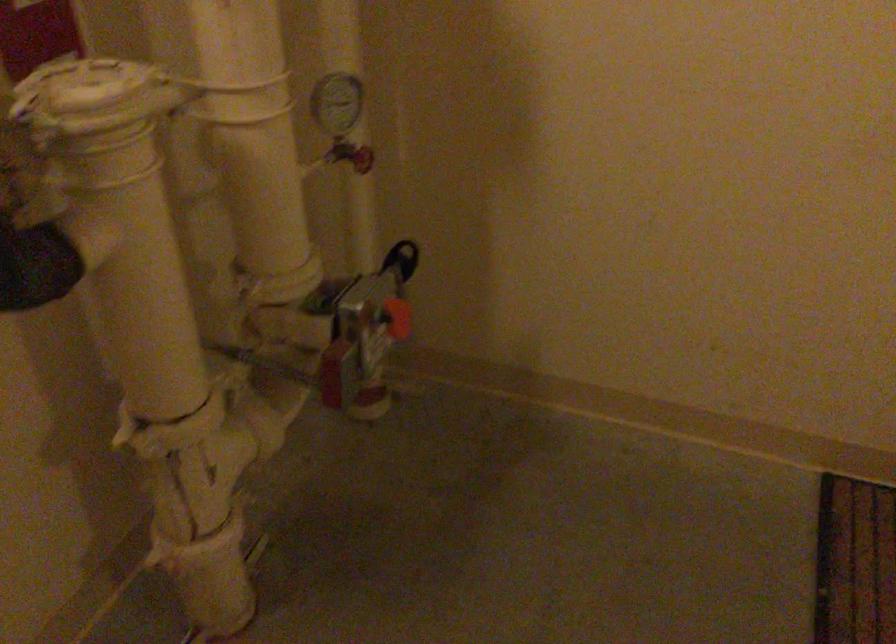
Find the location of a particular element. This screenshot has height=644, width=896. black valve handle is located at coordinates 401,252.